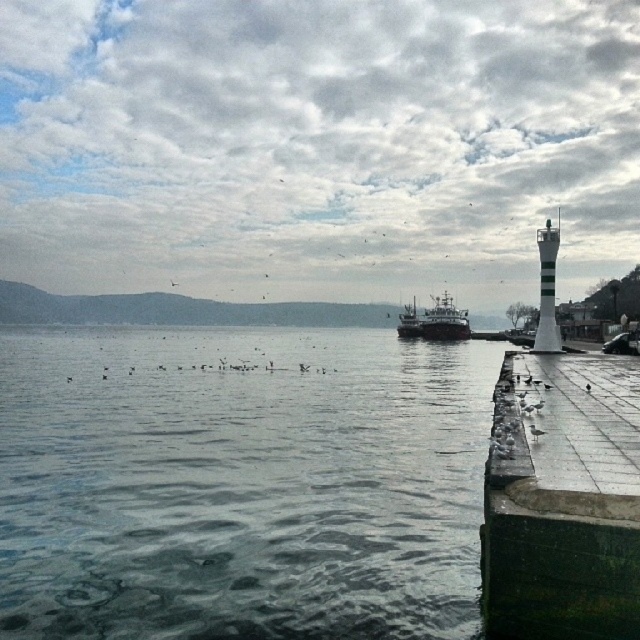
In the scene shown: Is gray matte water at lower left bigger than dark gray metallic ship at center?

No.

Does gray matte water at lower left have a smaller size compared to dark gray metallic ship at center?

Correct, gray matte water at lower left occupies less space than dark gray metallic ship at center.

This screenshot has width=640, height=640. What do you see at coordinates (241, 484) in the screenshot?
I see `gray matte water at lower left` at bounding box center [241, 484].

Find the location of a particular element. gray matte water at lower left is located at coordinates (241, 484).

Between gray matte water at lower left and green concrete dock at lower right, which one has more height?

green concrete dock at lower right is taller.

What do you see at coordinates (241, 484) in the screenshot? I see `gray matte water at lower left` at bounding box center [241, 484].

The image size is (640, 640). What are the coordinates of `gray matte water at lower left` in the screenshot? It's located at (241, 484).

Which of these two, green concrete dock at lower right or dark gray metallic ship at center, stands taller?

dark gray metallic ship at center

Who is positioned more to the right, green concrete dock at lower right or dark gray metallic ship at center?

dark gray metallic ship at center is more to the right.

Between point (552, 449) and point (420, 330), which one is positioned behind?

Positioned behind is point (420, 330).

Identify the location of green concrete dock at lower right. (563, 499).